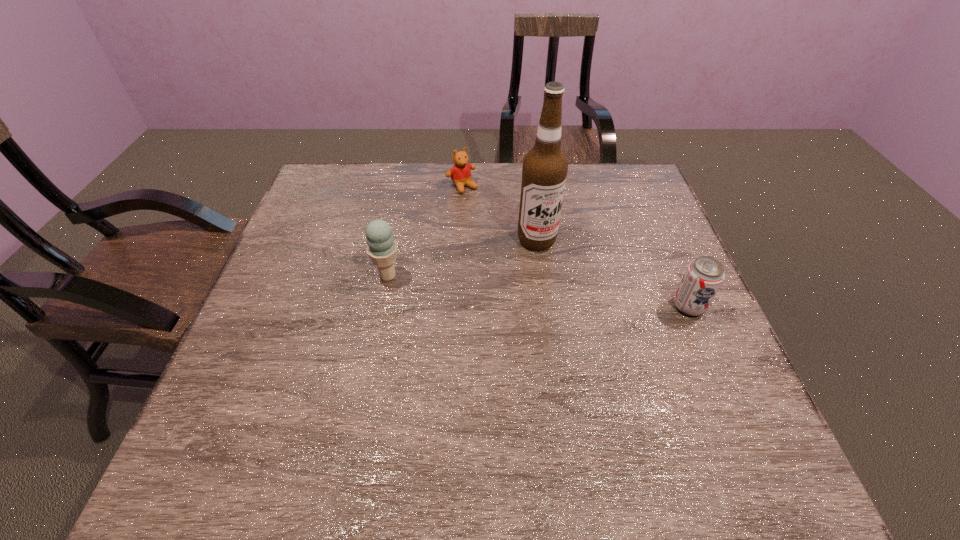
In the image, there is a desktop. What are the coordinates of `vacant space at the left edge` in the screenshot? It's located at (324, 269).

In the image, there is a desktop. Where is `vacant space at the right edge`? This screenshot has width=960, height=540. vacant space at the right edge is located at coordinates tap(676, 262).

Image resolution: width=960 pixels, height=540 pixels. In the image, there is a desktop. Identify the location of vacant space at the far left corner. (317, 202).

This screenshot has width=960, height=540. Identify the location of vacant space at the far right corner. (625, 191).

The width and height of the screenshot is (960, 540). In order to click on unoccupied position between the rightmost object and the farthest object in this screenshot , I will do `click(575, 246)`.

Identify the location of empty space between the third nearest object and the farthest object. pos(499,213).

The image size is (960, 540). I want to click on empty space between the second object from right to left and the third farthest object, so click(462, 258).

Identify the location of empty space between the farthest object and the beer can. (575, 246).

I want to click on unoccupied area between the leftmost object and the farthest object, so click(425, 231).

Find the location of `free spot between the farthest object and the alcohol`. free spot between the farthest object and the alcohol is located at coordinates (499, 213).